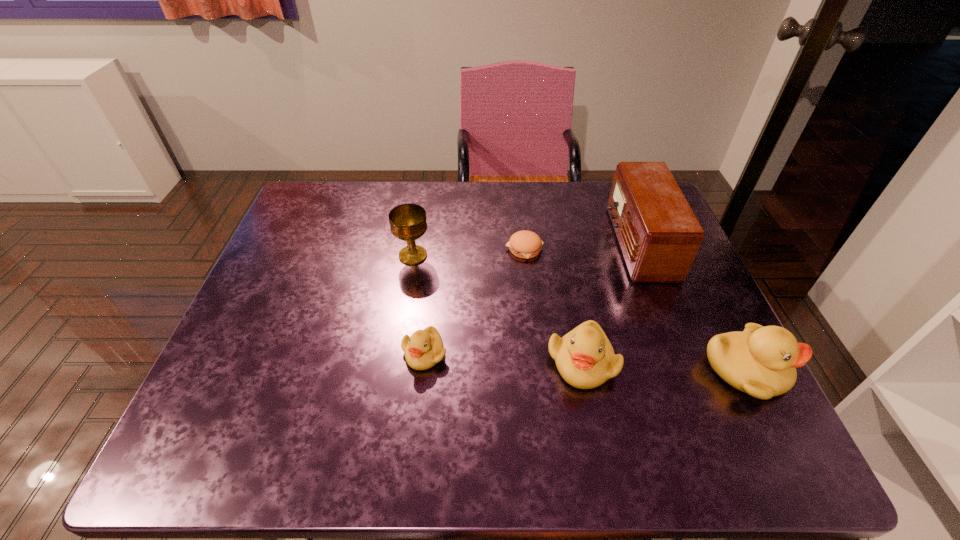
At what (x,y) coordinates should I click in order to perform the action: click on free point that keeps the ducklings evenly spaced on the left. Please return your answer as a coordinate pair (x, y). This screenshot has width=960, height=540. Looking at the image, I should click on (272, 345).